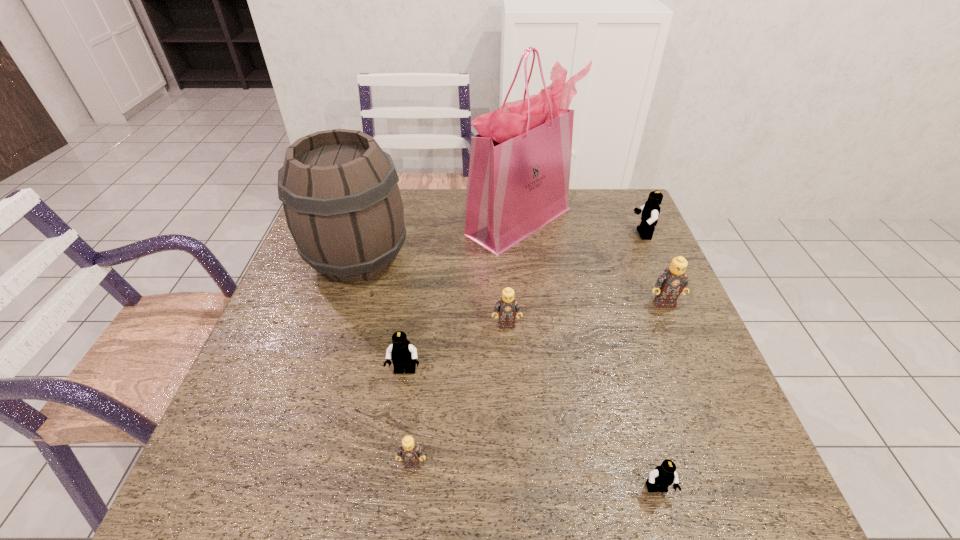
This screenshot has width=960, height=540. In the image, there is a desktop. In order to click on free space at the near edge in this screenshot , I will do `click(336, 494)`.

Where is `free space at the left edge of the desktop`? This screenshot has width=960, height=540. free space at the left edge of the desktop is located at coordinates (246, 434).

Locate an element on the screen. vacant point at the right edge is located at coordinates (617, 245).

You are a GUI agent. You are given a task and a screenshot of the screen. Output one action in this format:
    pyautogui.click(x=<x>, y=<y>)
    Task: Click on the free spot at the far right corner of the desktop
    
    Given the screenshot: What is the action you would take?
    pyautogui.click(x=609, y=197)

Locate an element on the screen. Image resolution: width=960 pixels, height=540 pixels. vacant space at the near right corner of the desktop is located at coordinates (710, 488).

This screenshot has height=540, width=960. I want to click on free space between the second farthest tan Lego and the nearest object, so click(582, 407).

Find the location of a particular element. This screenshot has height=540, width=960. free area in between the biggest tan Lego and the smallest black Lego is located at coordinates (660, 396).

Identify the location of free space between the second nearest object and the biggest tan Lego. (539, 383).

I want to click on vacant region between the third nearest Lego and the second farthest tan Lego, so [x=455, y=348].

This screenshot has width=960, height=540. I want to click on vacant area that lies between the smallest black Lego and the second tallest object, so click(x=508, y=374).